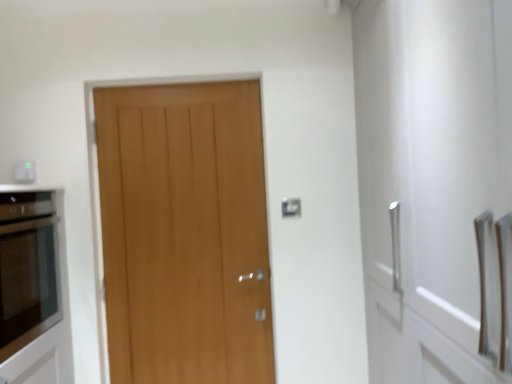
Question: In the image, is wooden door at center on the left side or the right side of matte glass oven at left?

Choices:
 (A) left
 (B) right

Answer: (B)

Question: In terms of width, does wooden door at center look wider or thinner when compared to matte glass oven at left?

Choices:
 (A) thin
 (B) wide

Answer: (A)

Question: Based on their relative distances, which object is nearer to the white plastic electric outlet at upper left?

Choices:
 (A) matte glass oven at left
 (B) wooden door at center

Answer: (A)

Question: Which object is positioned farthest from the white plastic electric outlet at upper left?

Choices:
 (A) wooden door at center
 (B) matte glass oven at left

Answer: (A)